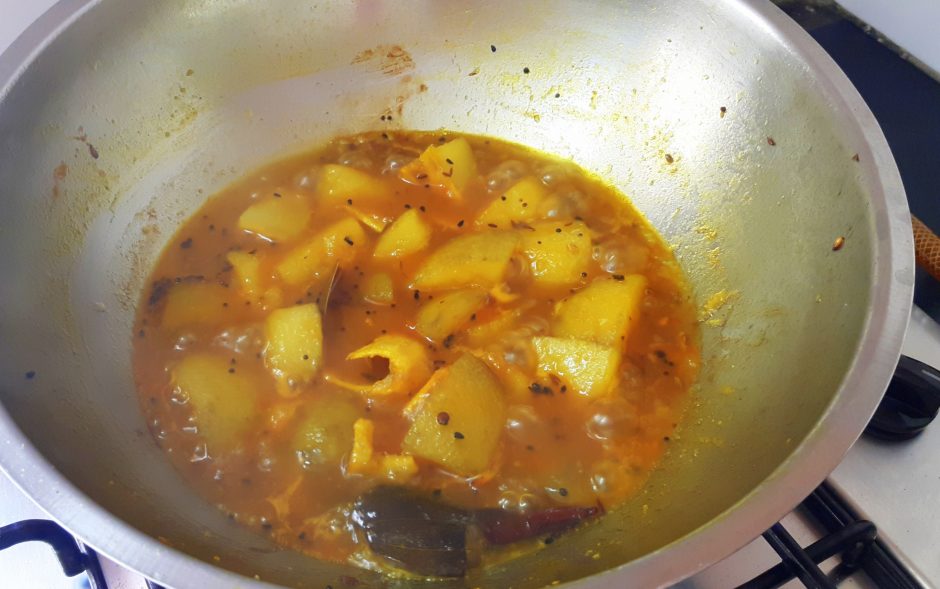
The height and width of the screenshot is (589, 940). I want to click on edge of bowl, so click(x=787, y=41), click(x=39, y=37), click(x=763, y=511), click(x=52, y=502).